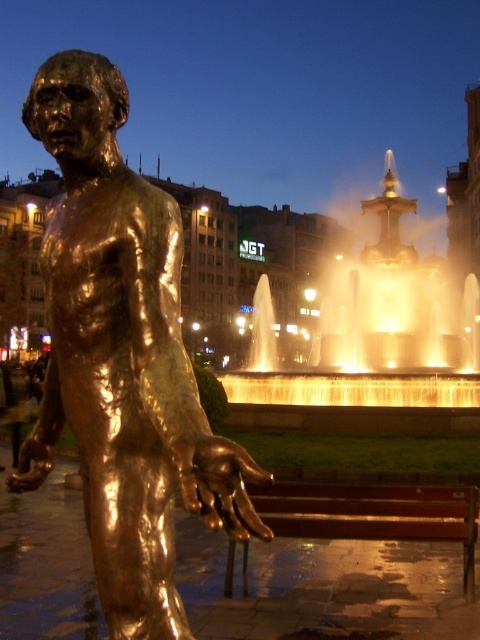
Question: Is bronze statue at left to the left of bronze polished bench at lower center from the viewer's perspective?

Choices:
 (A) yes
 (B) no

Answer: (A)

Question: Can you confirm if bronze statue at left is bigger than golden reflective water at center?

Choices:
 (A) no
 (B) yes

Answer: (A)

Question: Which object is the closest to the bronze statue at left?

Choices:
 (A) bronze polished bench at lower center
 (B) golden reflective water at center

Answer: (A)

Question: Does golden reflective water at center have a greater width compared to bronze polished bench at lower center?

Choices:
 (A) yes
 (B) no

Answer: (A)

Question: Which point is closer to the camera?

Choices:
 (A) bronze statue at left
 (B) bronze polished bench at lower center
 (C) golden reflective water at center

Answer: (A)

Question: Estimate the real-world distances between objects in this image. Which object is farther from the bronze polished bench at lower center?

Choices:
 (A) golden reflective water at center
 (B) bronze statue at left

Answer: (A)